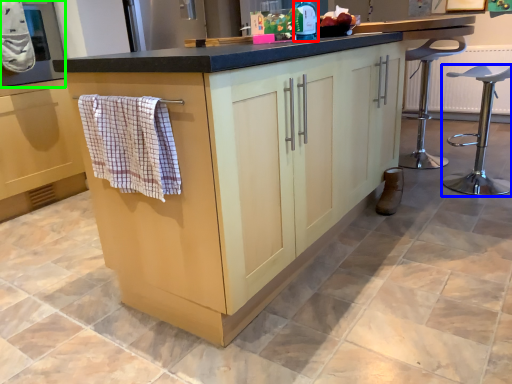
Question: Based on their relative distances, which object is nearer to bottle (highlighted by a red box)? Choose from furniture (highlighted by a blue box) and oven (highlighted by a green box).

Choices:
 (A) furniture
 (B) oven

Answer: (A)